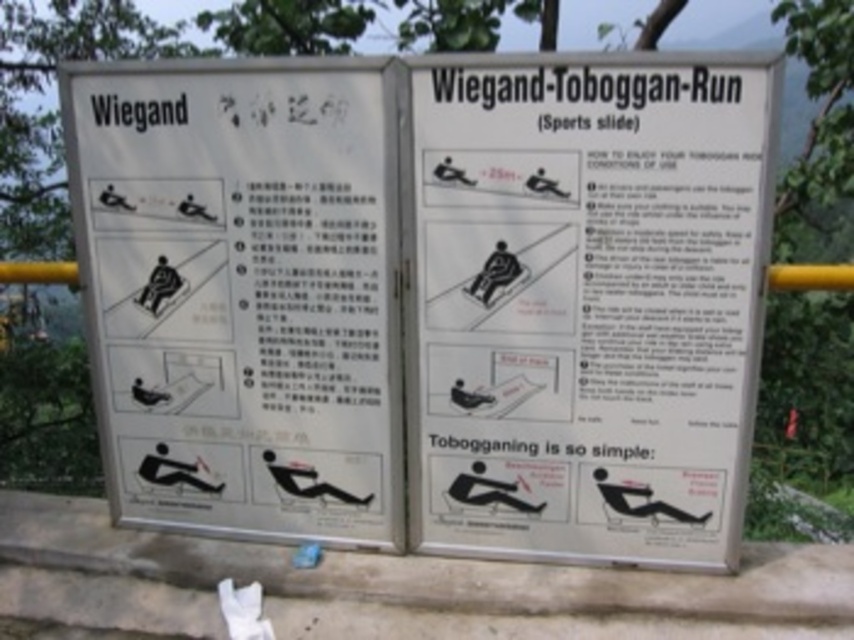
Question: Is white paper sign at center smaller than white paper signage at upper left?

Choices:
 (A) no
 (B) yes

Answer: (B)

Question: Is white paper sign at center thinner than white paper signage at upper left?

Choices:
 (A) yes
 (B) no

Answer: (A)

Question: Among these points, which one is farthest from the camera?

Choices:
 (A) (354, 397)
 (B) (706, 339)

Answer: (A)

Question: Considering the relative positions of white paper sign at center and white paper signage at upper left in the image provided, where is white paper sign at center located with respect to white paper signage at upper left?

Choices:
 (A) below
 (B) above

Answer: (A)